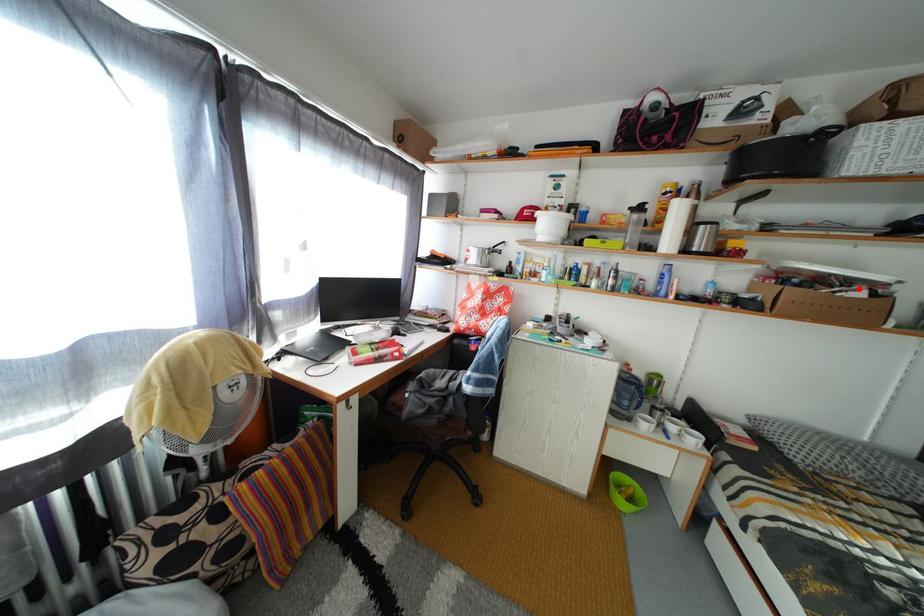
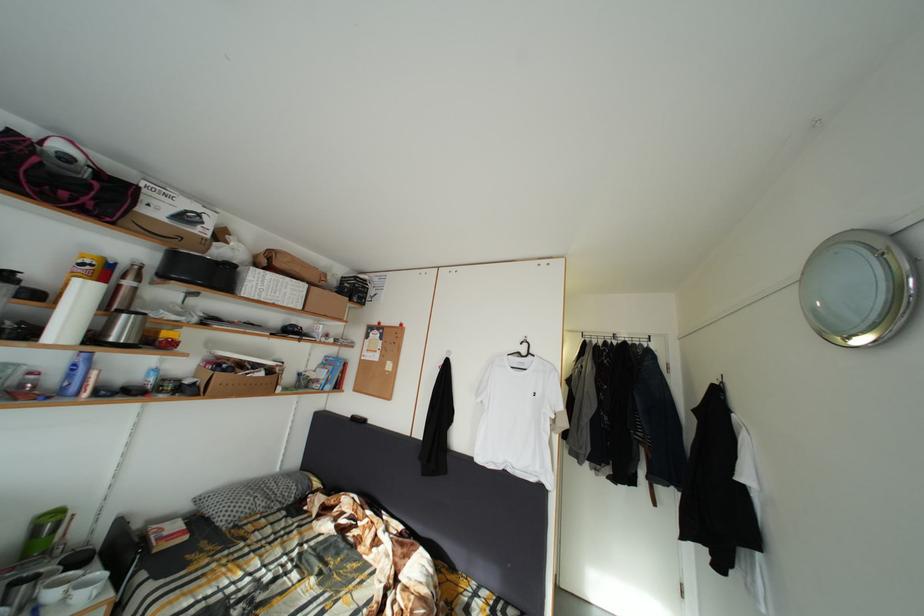
Find the pixel in the second image that matches the highlighted location in the first image.

(264, 373)